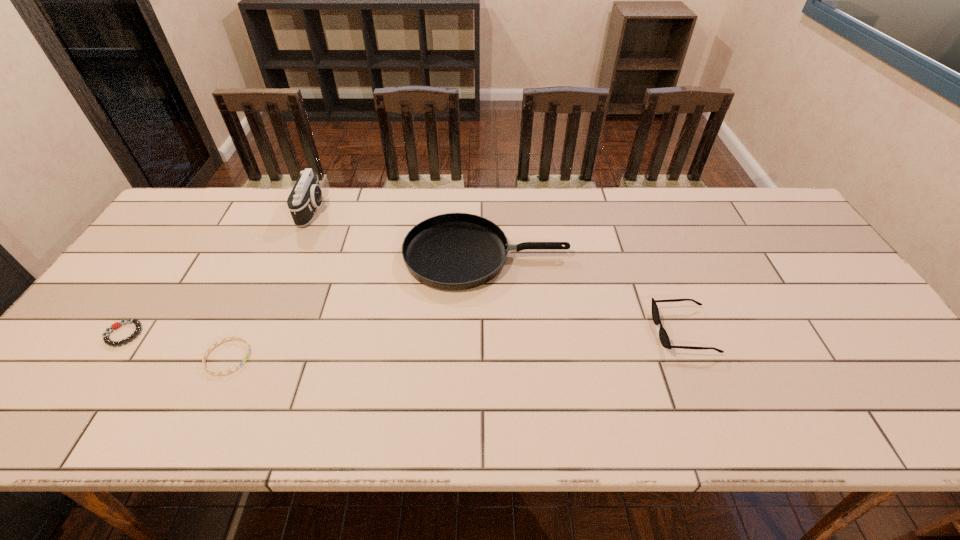
Identify the location of empty space between the tallest object and the leftmost object. point(219,272).

The width and height of the screenshot is (960, 540). Find the location of `object identified as the closest to the rightmost object`. object identified as the closest to the rightmost object is located at coordinates tap(453, 251).

Select which object is the second closest to the tallest object. Please provide its 2D coordinates. Your answer should be formatted as a tuple, i.e. [(x, y)], where the tuple contains the x and y coordinates of a point satisfying the conditions above.

[(239, 338)]

Where is `vacant space that satisfies the following two spatial constraints: 1. on the front lens of the camera; 2. on the front side of the leftmost object`? Image resolution: width=960 pixels, height=540 pixels. vacant space that satisfies the following two spatial constraints: 1. on the front lens of the camera; 2. on the front side of the leftmost object is located at coordinates (260, 334).